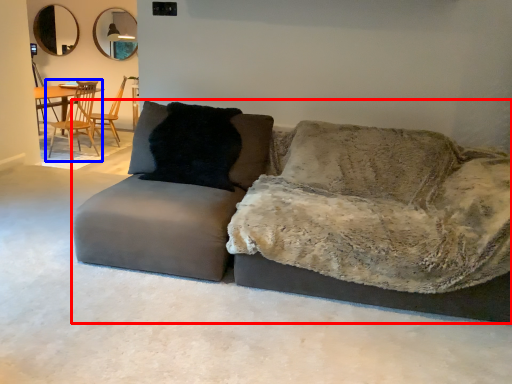
Question: Which point is closer to the camera, studio couch (highlighted by a red box) or chair (highlighted by a blue box)?

Choices:
 (A) studio couch
 (B) chair

Answer: (A)